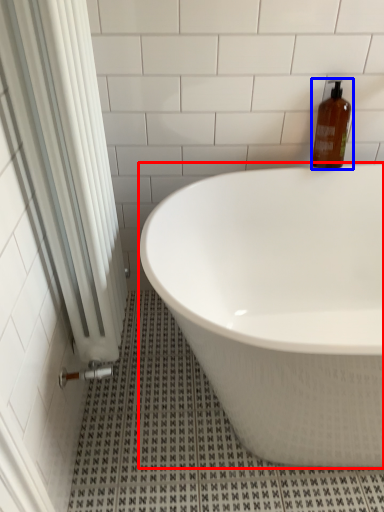
Question: Among these objects, which one is nearest to the camera, bathtub (highlighted by a red box) or bottle (highlighted by a blue box)?

Choices:
 (A) bathtub
 (B) bottle

Answer: (A)